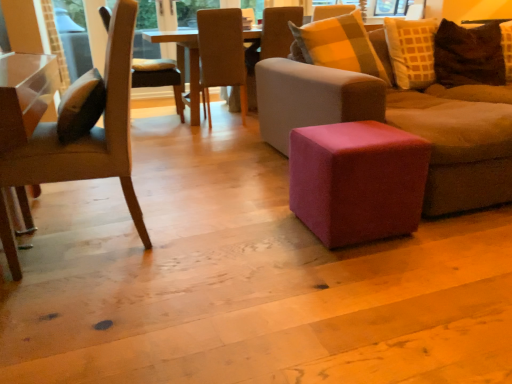
At what (x,y) coordinates should I click in order to perform the action: click on free space between matte brown chair at left, which is counted as the 4th chair, starting from the back, and pink fabric stool at center. Please return your answer as a coordinate pair (x, y). The height and width of the screenshot is (384, 512). Looking at the image, I should click on (226, 230).